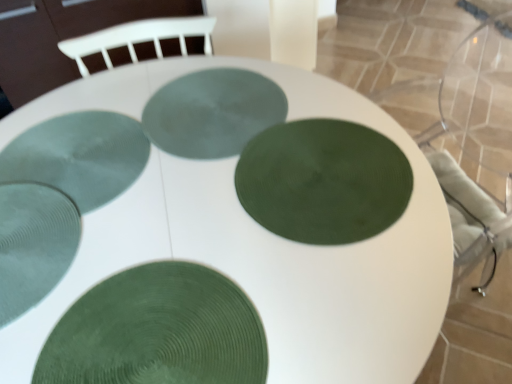
Where is `free spot behind clear textured glass at bottom left, positioned as the 2th glass plate in front-to-back order`? This screenshot has height=384, width=512. free spot behind clear textured glass at bottom left, positioned as the 2th glass plate in front-to-back order is located at coordinates (69, 140).